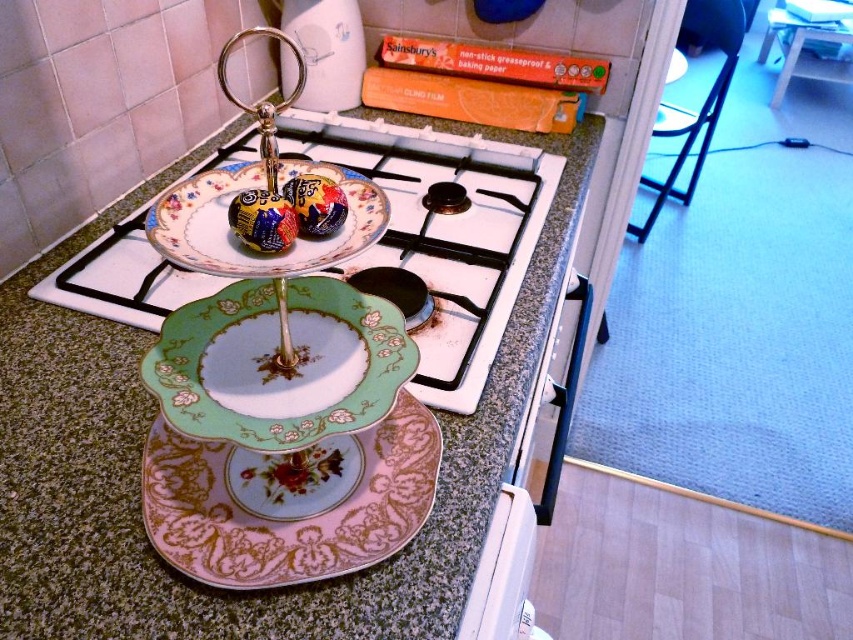
You are organizing a kitchen display and want to stack the green porcelain plate at center and the porcelain floral plate at center. Which plate should you place on top to ensure stability?

The green porcelain plate at center has a greater height compared to the porcelain floral plate at center, so placing the shorter porcelain floral plate at center on top of the taller green porcelain plate at center would provide better stability.

You are a chef preparing to place a new dessert on the kitchen countertop. The porcelain plate at center and the pink porcelain platter at center are both available. Which one should you choose if you need a larger surface area to display a single, elaborate cake?

The porcelain plate at center is larger in size than the pink porcelain platter at center, so you should choose the porcelain plate at center to display the single, elaborate cake as it provides a larger surface area.

You are a chef trying to place a new ingredient between the green porcelain plate at center and the matte ceramic chocolate at center on the kitchen countertop. The ingredient takes up 3 inches of space. Can you fit it between them?

The distance between the green porcelain plate at center and the matte ceramic chocolate at center is 4.62 inches. Since the ingredient requires 3 inches of space, there is enough room to place it between them.